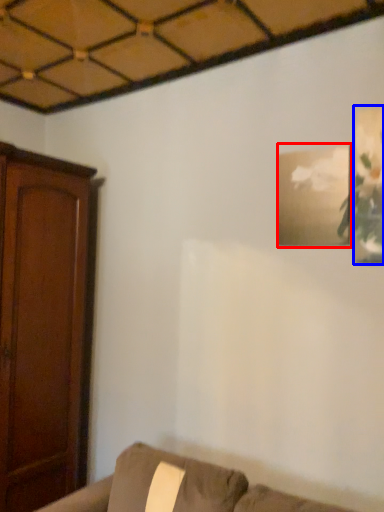
Question: Which of the following is the farthest to the observer, picture frame (highlighted by a red box) or picture frame (highlighted by a blue box)?

Choices:
 (A) picture frame
 (B) picture frame

Answer: (A)